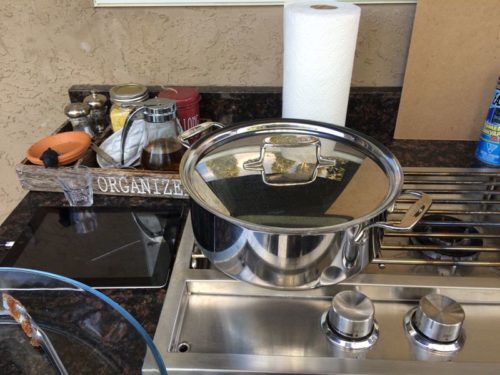
Where is `pot lid`? The image size is (500, 375). pot lid is located at coordinates (314, 205), (73, 345).